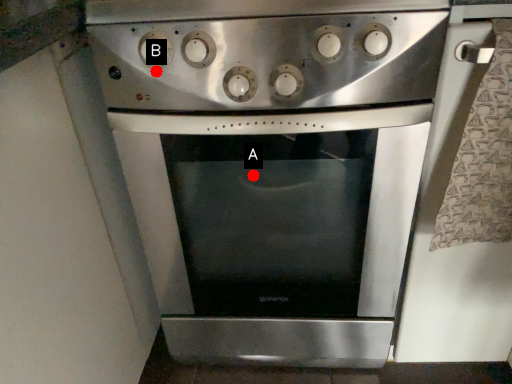
Question: Two points are circled on the image, labeled by A and B beside each circle. Which point is closer to the camera?

Choices:
 (A) A is closer
 (B) B is closer

Answer: (B)